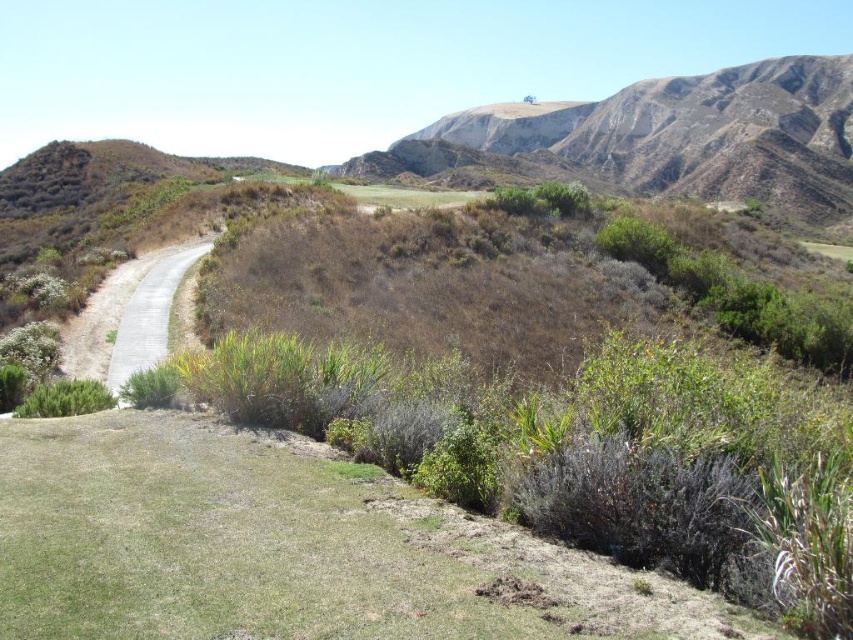
You are standing at the point labeled as point (283, 547) in the image. Looking around, you see the green grassy area at lower left. Which direction should you walk to reach the pathway cutting through the grassy area?

Since the point (283, 547) is on the green grassy area at lower left, you should walk towards the upper right direction to reach the pathway cutting through the grassy area.

You are a landscape architect designing a new golf course. You have to decide where to place a new water hazard. The green grassy at lower left and the rugged brown mountain at upper right are in your design. Considering their widths, which area would you choose for the water hazard and why?

The green grassy at lower left has a smaller width compared to the rugged brown mountain at upper right. Therefore, the water hazard should be placed in the green grassy at lower left because its narrower width makes it more suitable for containing water without overwhelming the landscape.

You are standing at the center of the image and want to walk towards the rugged brown mountain at upper right. Which direction should you move relative to the green grassy at lower left?

Since the green grassy at lower left is to the left of rugged brown mountain at upper right, you should move to the right of the green grassy at lower left to head towards the rugged brown mountain at upper right.